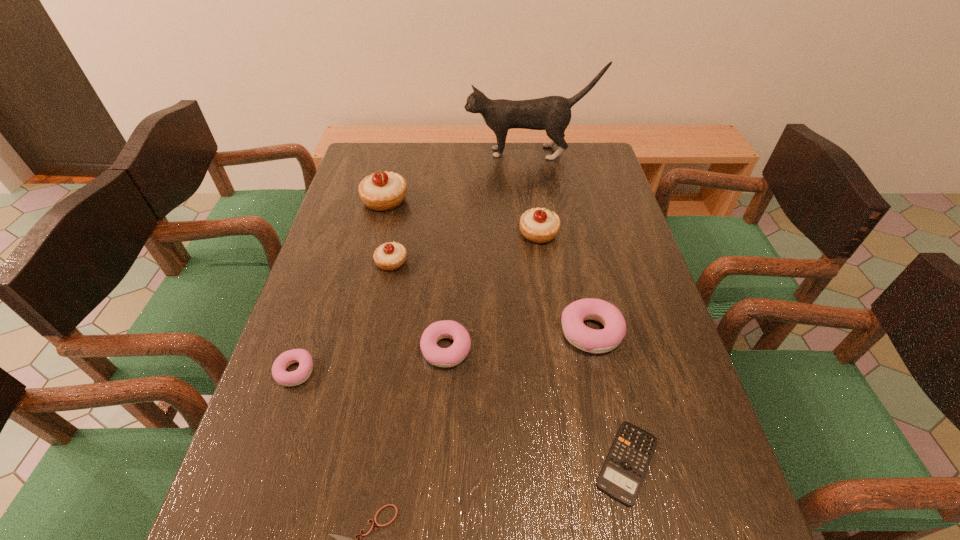
Where is `free space at the far edge`? free space at the far edge is located at coordinates (491, 148).

Image resolution: width=960 pixels, height=540 pixels. In the image, there is a desktop. In order to click on free region at the left edge in this screenshot , I will do `click(353, 225)`.

Find the location of `free spot at the right edge of the desktop`. free spot at the right edge of the desktop is located at coordinates (629, 314).

Where is `vacant point at the far left corner`? The height and width of the screenshot is (540, 960). vacant point at the far left corner is located at coordinates (371, 167).

Identify the location of vacant area that lies between the shortest pastry and the eighth tallest object. (461, 417).

Where is `vacant space that's between the eighth tallest object and the second pink pastry from left to right`? vacant space that's between the eighth tallest object and the second pink pastry from left to right is located at coordinates (537, 406).

Find the location of a particular element. unoccupied area between the cat and the fourth shortest object is located at coordinates (488, 251).

Locate an element on the screen. The width and height of the screenshot is (960, 540). vacant area that lies between the sixth tallest object and the rightmost pink pastry is located at coordinates (518, 341).

Locate an element on the screen. This screenshot has height=540, width=960. unoccupied area between the farthest pastry and the rightmost pink pastry is located at coordinates (488, 266).

This screenshot has height=540, width=960. What are the coordinates of `free space between the fourth farthest object and the tallest object` in the screenshot? It's located at (461, 207).